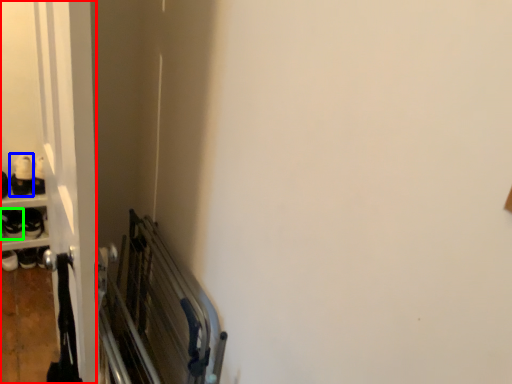
Question: Which object is positioned closest to door (highlighted by a red box)? Select from footwear (highlighted by a blue box) and footwear (highlighted by a green box).

Choices:
 (A) footwear
 (B) footwear

Answer: (A)